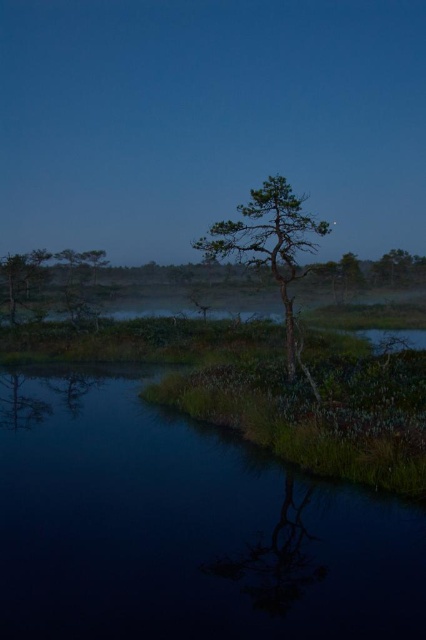
You are standing at the edge of the marsh and want to cross to the other side. You see the transparent water at lower center and the green matte tree at left. Which object is closer to the ground?

The transparent water at lower center is shorter than the green matte tree at left, so the transparent water at lower center is closer to the ground.

You are standing in the marshy landscape and want to walk towards both point (273,461) and point (229,256). Which point will you reach first?

You will reach point (273,461) first because it is closer to you than point (229,256).